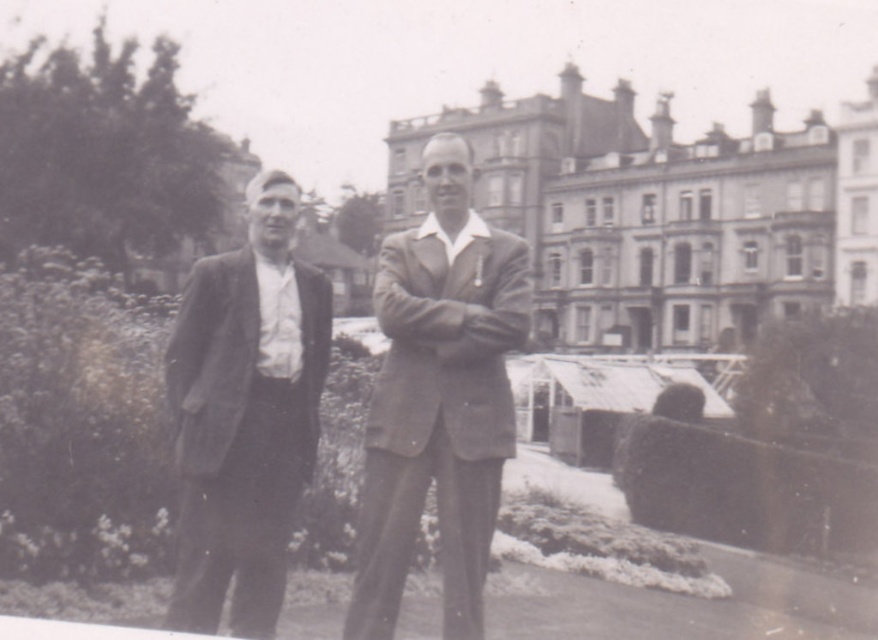
You are a photographer positioned in front of the two men in the image. You want to take a closer photo of the smooth brown suit at center and the smooth woolen suit at left. Which suit should you adjust your camera focus on first to ensure it appears sharp in the photo?

The smooth brown suit at center is closer to you than the smooth woolen suit at left, so you should focus on the smooth brown suit at center first to ensure it appears sharp.

You are standing in the garden looking at the two men. Which of the two points, point (x=418, y=442) or point (x=184, y=499), is nearer to you?

Point (x=418, y=442) is closer to the viewer than point (x=184, y=499).